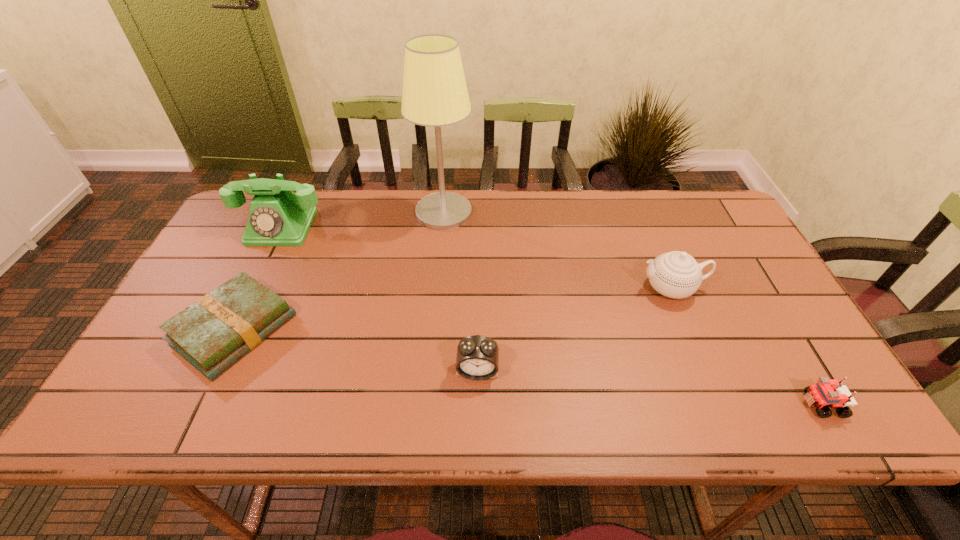
This screenshot has height=540, width=960. I want to click on vacant space located 0.290m on the spout of the chinaware, so click(x=531, y=288).

You are a GUI agent. You are given a task and a screenshot of the screen. Output one action in this format:
    pyautogui.click(x=<x>, y=<y>)
    Task: Click on the vacant space located 0.300m on the spout of the chinaware
    
    Given the screenshot: What is the action you would take?
    pyautogui.click(x=527, y=288)

Identify the location of free location located 0.070m on the front side of the fourth tallest object. (477, 411).

Identify the location of vacant space situated 0.340m on the front-facing side of the Lego. (647, 404).

Where is `free space located 0.200m on the front-facing side of the Lego`? free space located 0.200m on the front-facing side of the Lego is located at coordinates (711, 404).

Where is `vacant position located on the front-facing side of the Lego`? The image size is (960, 540). vacant position located on the front-facing side of the Lego is located at coordinates (684, 404).

At what (x,y) coordinates should I click in order to perform the action: click on vacant space located on the back of the shortest object. Please return your answer as a coordinate pair (x, y). The height and width of the screenshot is (540, 960). Looking at the image, I should click on (265, 265).

Where is `table lamp at the far edge`? Image resolution: width=960 pixels, height=540 pixels. table lamp at the far edge is located at coordinates (435, 94).

Image resolution: width=960 pixels, height=540 pixels. Find the location of `telephone present at the far edge`. telephone present at the far edge is located at coordinates (277, 217).

At what (x,y) coordinates should I click in order to perform the action: click on object that is at the near edge. Please return your answer as a coordinate pair (x, y). The image size is (960, 540). Looking at the image, I should click on (826, 393).